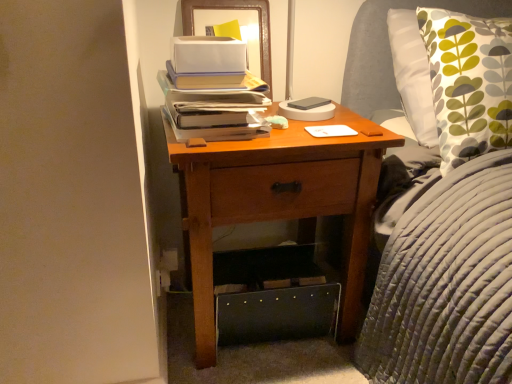
Question: Is the position of wooden nightstand at center less distant than that of wooden framed picture at upper center?

Choices:
 (A) yes
 (B) no

Answer: (A)

Question: Can wooden framed picture at upper center be found inside wooden nightstand at center?

Choices:
 (A) yes
 (B) no

Answer: (B)

Question: Considering the relative sizes of wooden nightstand at center and wooden framed picture at upper center in the image provided, is wooden nightstand at center taller than wooden framed picture at upper center?

Choices:
 (A) yes
 (B) no

Answer: (A)

Question: Is wooden nightstand at center next to wooden framed picture at upper center?

Choices:
 (A) no
 (B) yes

Answer: (A)

Question: Are wooden nightstand at center and wooden framed picture at upper center located far from each other?

Choices:
 (A) yes
 (B) no

Answer: (B)

Question: Considering their positions, is wooden nightstand at center located in front of or behind matte paper stack of books at center?

Choices:
 (A) front
 (B) behind

Answer: (A)

Question: From the image's perspective, relative to matte paper stack of books at center, is wooden nightstand at center above or below?

Choices:
 (A) above
 (B) below

Answer: (B)

Question: Considering the positions of wooden nightstand at center and matte paper stack of books at center in the image, is wooden nightstand at center taller or shorter than matte paper stack of books at center?

Choices:
 (A) short
 (B) tall

Answer: (B)

Question: From a real-world perspective, is wooden nightstand at center physically located above or below matte paper stack of books at center?

Choices:
 (A) below
 (B) above

Answer: (A)

Question: Looking at the image, does wooden nightstand at center seem bigger or smaller compared to white matte notepad at center?

Choices:
 (A) big
 (B) small

Answer: (A)

Question: From a real-world perspective, is wooden nightstand at center physically located above or below white matte notepad at center?

Choices:
 (A) above
 (B) below

Answer: (B)

Question: From the image's perspective, relative to white matte notepad at center, is wooden nightstand at center above or below?

Choices:
 (A) above
 (B) below

Answer: (B)

Question: Considering the positions of point (317, 142) and point (345, 125), is point (317, 142) closer or farther from the camera than point (345, 125)?

Choices:
 (A) farther
 (B) closer

Answer: (B)

Question: From the image's perspective, is matte paper stack of books at center located above or below white matte notepad at center?

Choices:
 (A) above
 (B) below

Answer: (A)

Question: From their relative heights in the image, would you say matte paper stack of books at center is taller or shorter than white matte notepad at center?

Choices:
 (A) tall
 (B) short

Answer: (A)